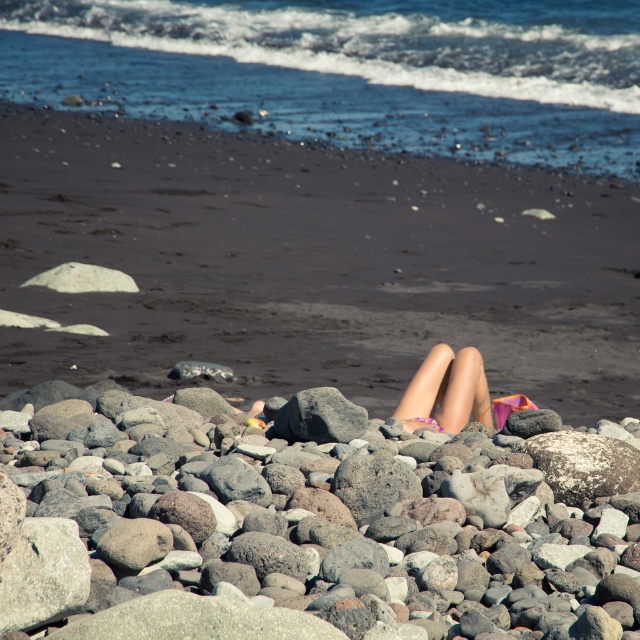
Question: In this image, where is gray rough rock at lower center located relative to pink fabric legs at center?

Choices:
 (A) right
 (B) left

Answer: (B)

Question: Is smooth sand at center bigger than gray rough rock at lower center?

Choices:
 (A) no
 (B) yes

Answer: (B)

Question: Which point is closer to the camera taking this photo?

Choices:
 (A) (419, 545)
 (B) (477, 380)
 (C) (280, 412)
 (D) (97, 182)

Answer: (A)

Question: Which point is closer to the camera taking this photo?

Choices:
 (A) (328, 404)
 (B) (378, 493)

Answer: (B)

Question: Can you confirm if gray rough rock at lower center is bigger than pink fabric legs at center?

Choices:
 (A) yes
 (B) no

Answer: (A)

Question: Which point is closer to the camera taking this photo?

Choices:
 (A) (372, 397)
 (B) (252, 445)
 (C) (435, 349)

Answer: (B)